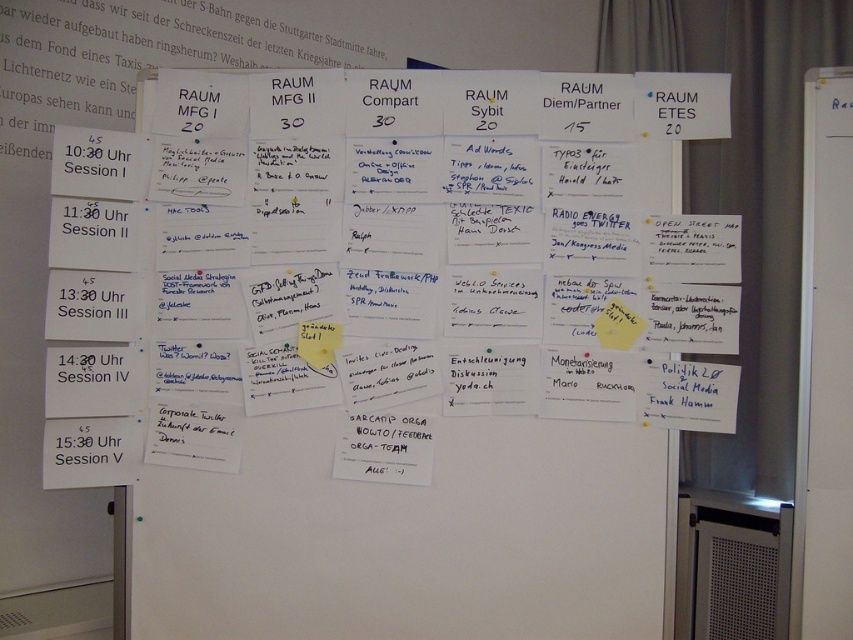
Which is behind, point (827, 282) or point (631, 332)?

The point (631, 332) is more distant.

How distant is white paperboard at right from yellow paper at center?

white paperboard at right is 39.25 centimeters away from yellow paper at center.

Which is in front, point (837, 396) or point (630, 346)?

Point (837, 396) is in front.

Where is `white paperboard at right`? Image resolution: width=853 pixels, height=640 pixels. white paperboard at right is located at coordinates (824, 365).

Is yellow paper at center smaller than yellow sticky note at center?

Incorrect, yellow paper at center is not smaller in size than yellow sticky note at center.

Is yellow paper at center taller than yellow sticky note at center?

Yes, yellow paper at center is taller than yellow sticky note at center.

What do you see at coordinates (618, 324) in the screenshot?
I see `yellow paper at center` at bounding box center [618, 324].

In order to click on yellow paper at center in this screenshot , I will do `click(618, 324)`.

Looking at this image, does white paperboard at right have a lesser width compared to yellow sticky note at center?

Incorrect, white paperboard at right's width is not less than yellow sticky note at center's.

Which of these two, white paperboard at right or yellow sticky note at center, stands shorter?

yellow sticky note at center

Locate an element on the screen. white paperboard at right is located at coordinates (824, 365).